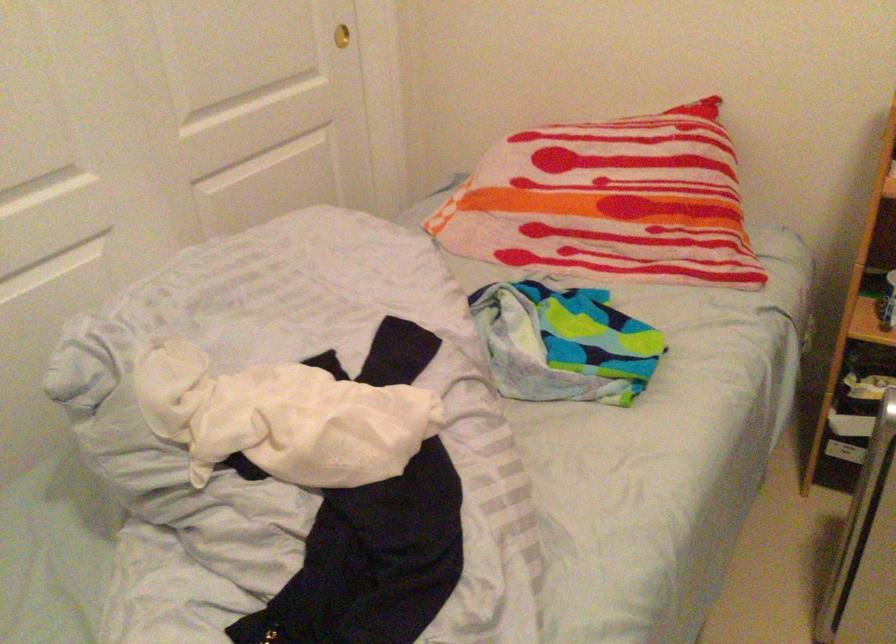
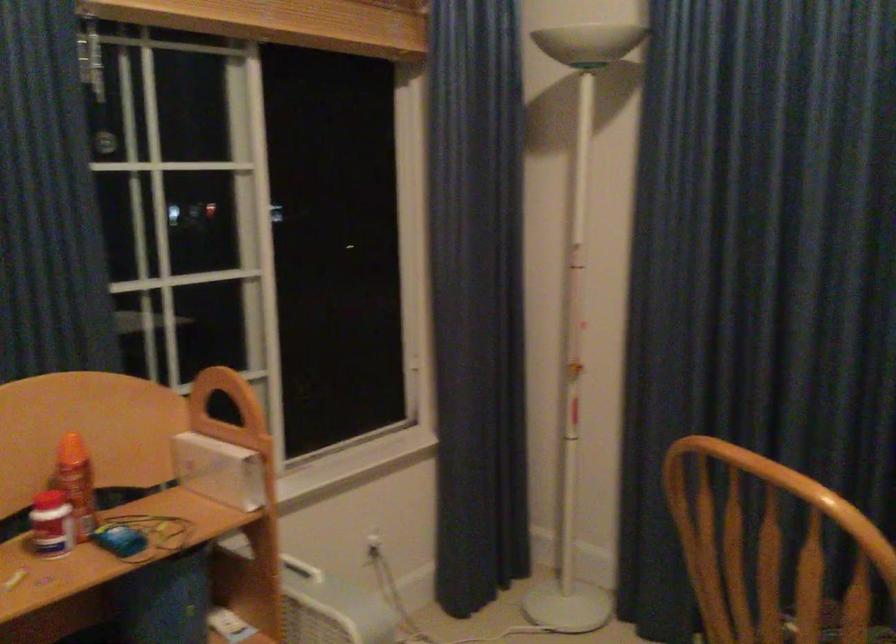
Question: The images are taken continuously from a first-person perspective. In which direction is your viewpoint rotating?

Choices:
 (A) Left
 (B) Right
 (C) Up
 (D) Down

Answer: (B)